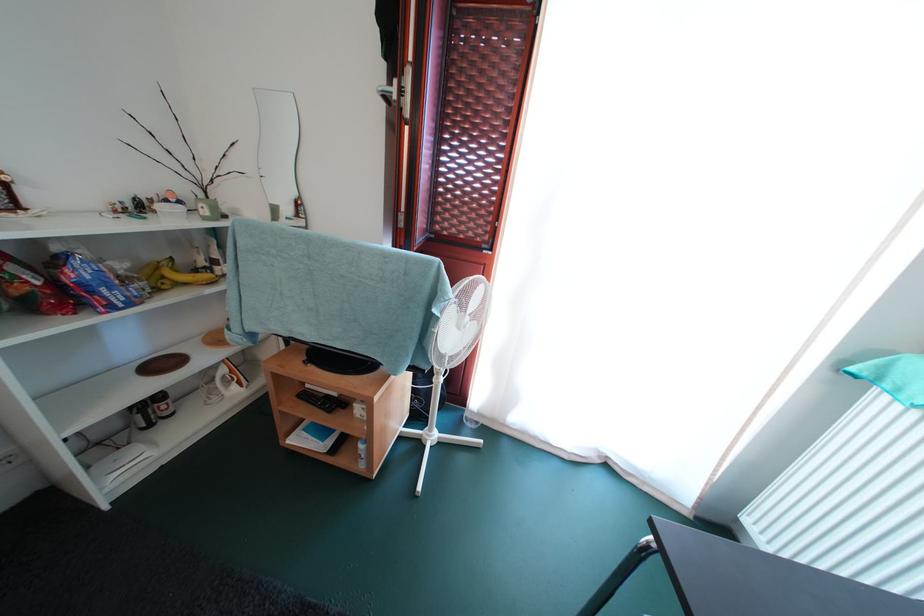
Where would you lift the bunch of bananas? Please return your answer as a coordinate pair (x, y).

(174, 275)